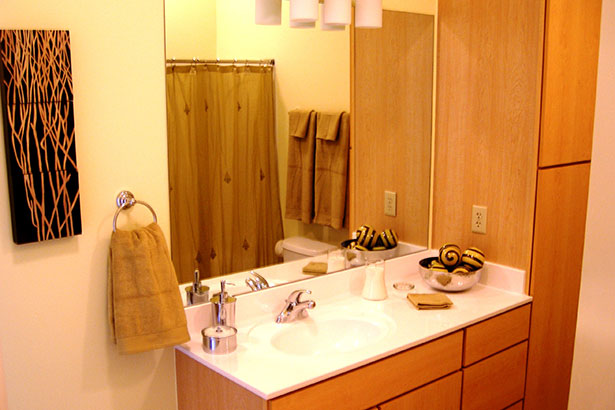
At what (x,y) coordinates should I click in order to perform the action: click on faucet. Please return your answer as a coordinate pair (x, y). The image size is (615, 410). Looking at the image, I should click on (300, 312), (296, 297).